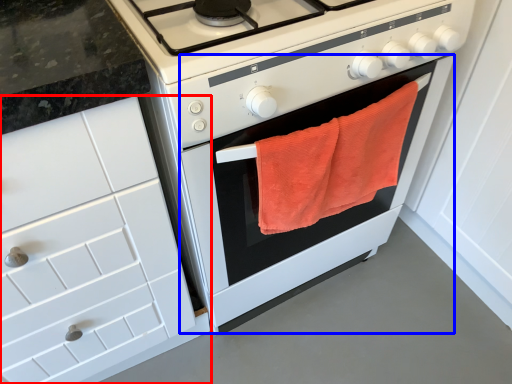
Question: Which point is further to the camera, cabinetry (highlighted by a red box) or oven (highlighted by a blue box)?

Choices:
 (A) cabinetry
 (B) oven

Answer: (B)